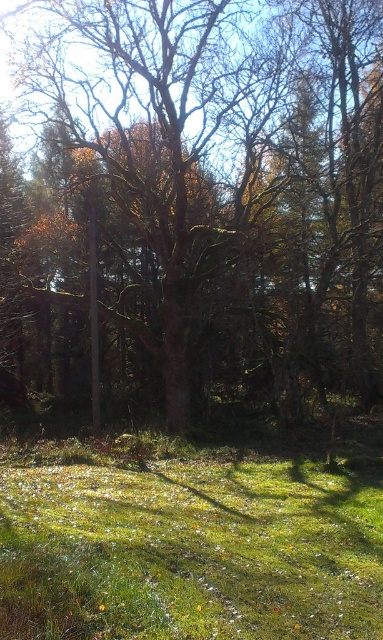
Does brown rough tree at center have a greater height compared to green grassy field at lower center?

Correct, brown rough tree at center is much taller as green grassy field at lower center.

You are a GUI agent. You are given a task and a screenshot of the screen. Output one action in this format:
    pyautogui.click(x=<x>, y=<y>)
    Task: Click on the brown rough tree at center
    The width and height of the screenshot is (383, 640).
    Given the screenshot: What is the action you would take?
    pyautogui.click(x=219, y=182)